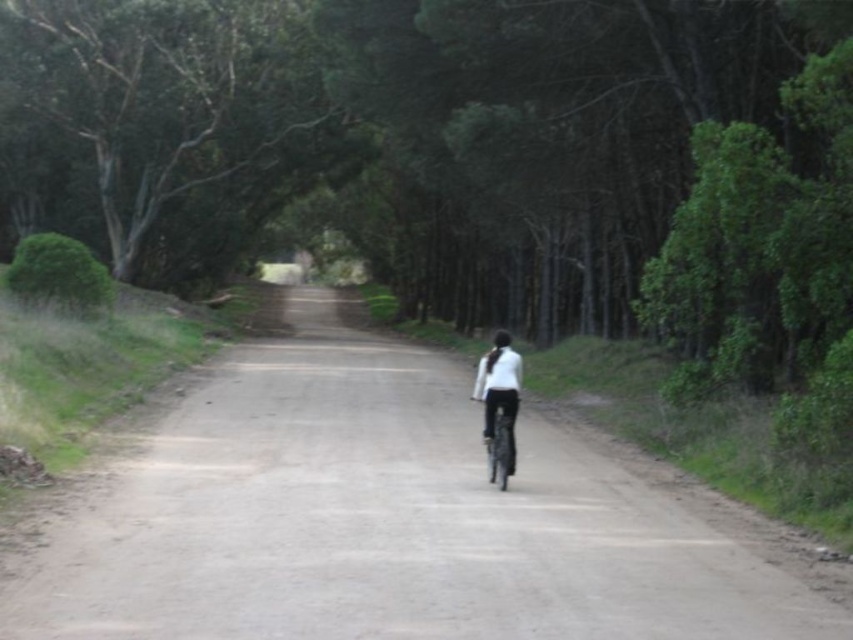
Question: Is dirt road at center smaller than green leafy tree at upper center?

Choices:
 (A) yes
 (B) no

Answer: (A)

Question: Which of the following is the farthest from the observer?

Choices:
 (A) (79, 56)
 (B) (514, 420)
 (C) (410, 454)
 (D) (508, 436)

Answer: (A)

Question: Which object is closer to the camera taking this photo?

Choices:
 (A) dirt road at center
 (B) white matte jacket at center

Answer: (A)

Question: Based on their relative distances, which object is nearer to the green leafy tree at upper center?

Choices:
 (A) white matte jacket at center
 (B) dirt road at center

Answer: (B)

Question: Does green leafy tree at upper center lie behind shiny metallic bicycle at center?

Choices:
 (A) yes
 (B) no

Answer: (A)

Question: From the image, what is the correct spatial relationship of dirt road at center in relation to white matte jacket at center?

Choices:
 (A) above
 (B) below

Answer: (B)